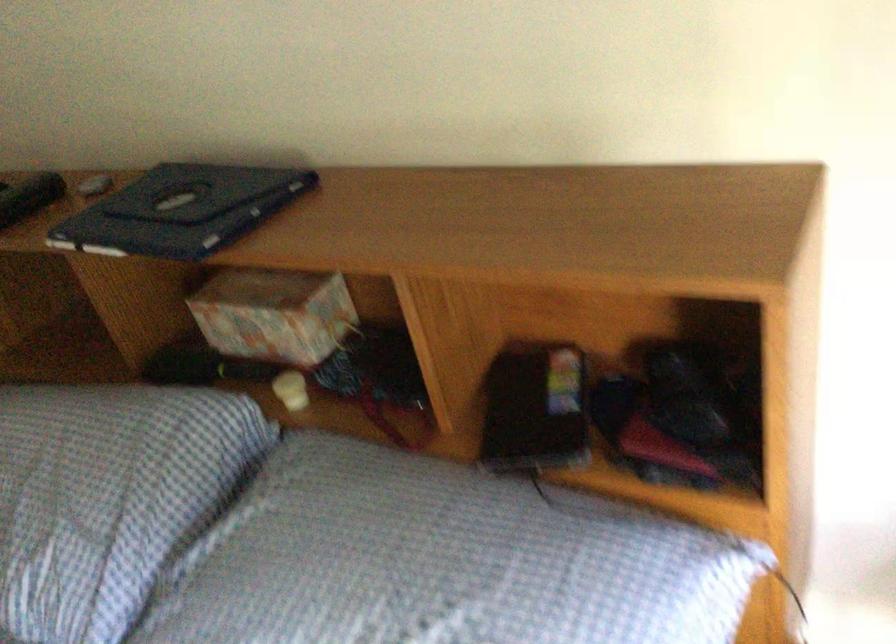
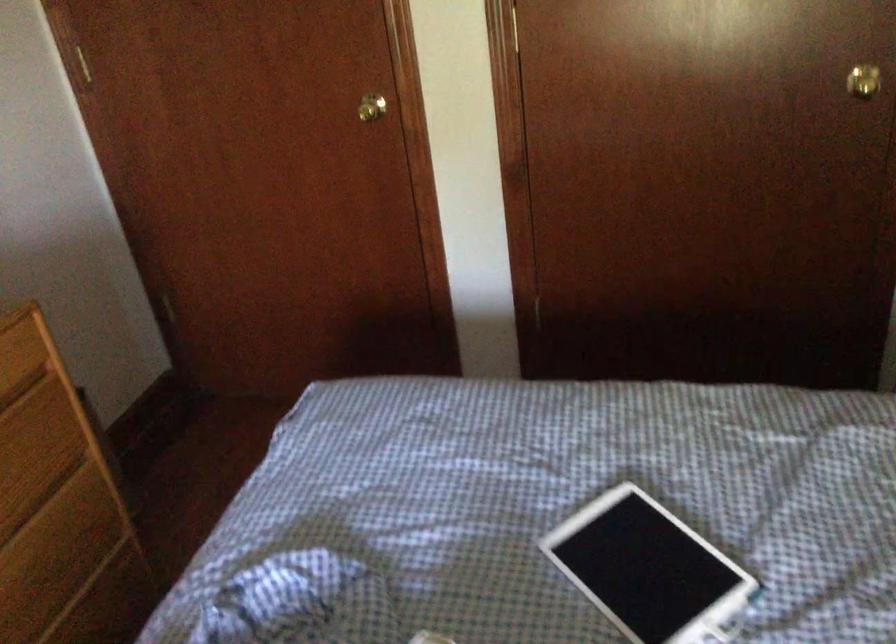
How did the camera likely rotate?

The rotation direction of the camera is left-down.